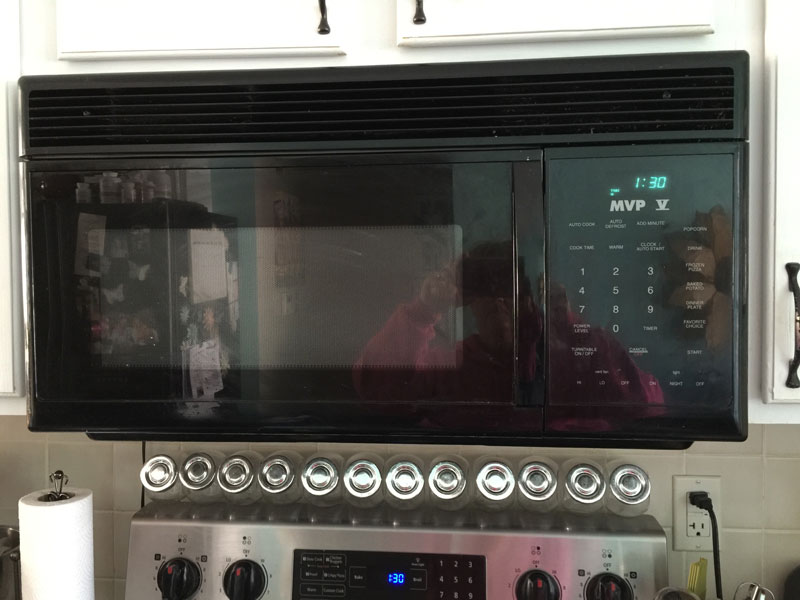
Locate an element on the screen. The width and height of the screenshot is (800, 600). microwave is located at coordinates (393, 124).